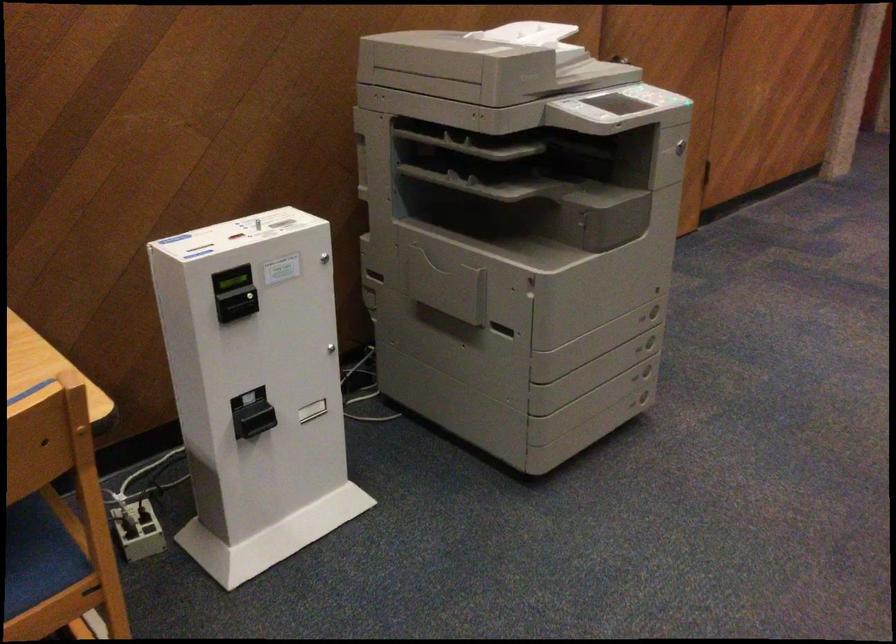
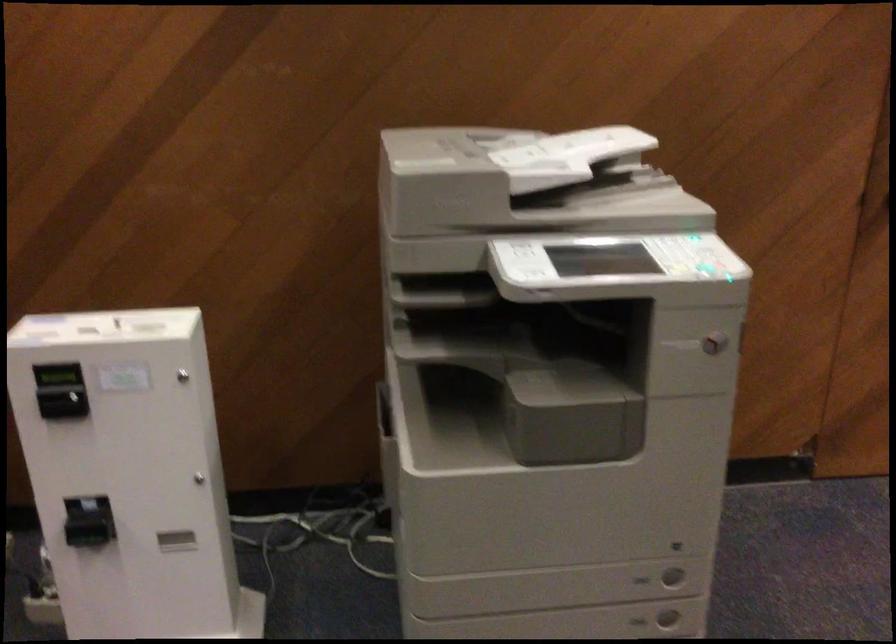
The point at (665, 98) is marked in the first image. Where is the corresponding point in the second image?

(698, 266)